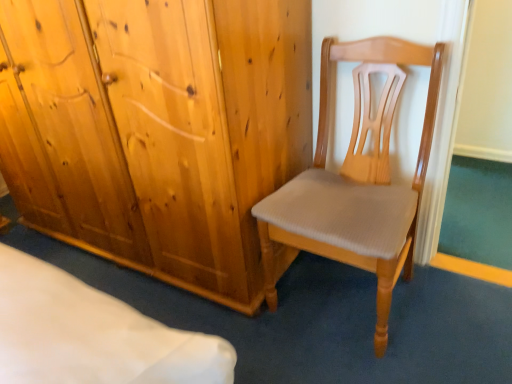
Find the location of a particular element. The height and width of the screenshot is (384, 512). free space between light brown wood chair at center and natural wood wardrobe at center is located at coordinates (296, 342).